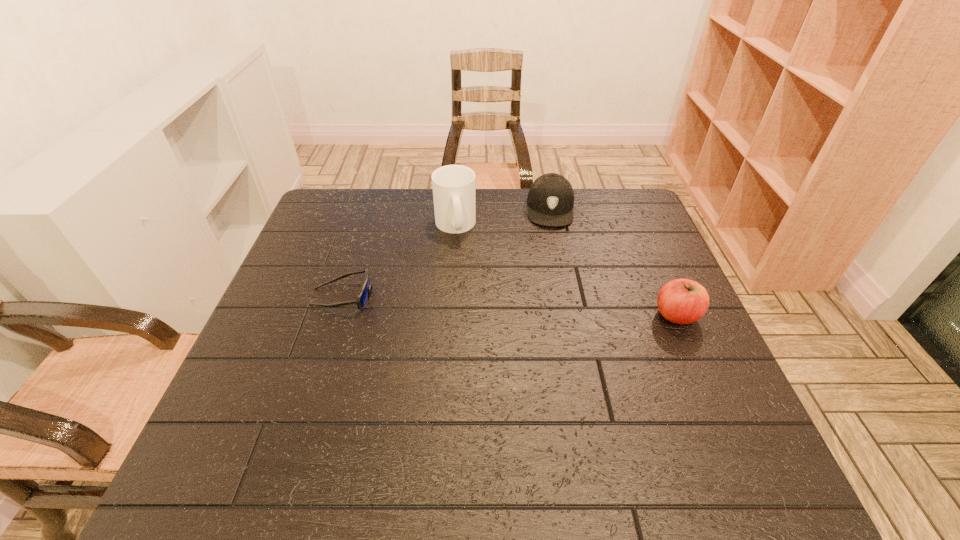
Image resolution: width=960 pixels, height=540 pixels. In order to click on the leftmost object in this screenshot , I will do `click(363, 297)`.

What are the coordinates of `the shortest object` in the screenshot? It's located at (363, 297).

Identify the location of apple. Image resolution: width=960 pixels, height=540 pixels. (x=682, y=301).

This screenshot has height=540, width=960. What are the coordinates of `the tallest object` in the screenshot? It's located at (453, 186).

Where is `the third object from right to left`? Image resolution: width=960 pixels, height=540 pixels. the third object from right to left is located at coordinates (453, 186).

I want to click on the second object from right to left, so click(550, 198).

This screenshot has width=960, height=540. What are the coordinates of `free location located on the front-facing side of the sunglasses` in the screenshot? It's located at (420, 296).

You are a GUI agent. You are given a task and a screenshot of the screen. Output one action in this format:
    pyautogui.click(x=<x>, y=<y>)
    Task: Click on the vacant position located 0.300m on the left of the rightmost object
    This screenshot has height=540, width=960.
    Given the screenshot: What is the action you would take?
    pyautogui.click(x=530, y=315)

Locate an element on the screen. The width and height of the screenshot is (960, 540). vacant area situated on the handle side of the mug is located at coordinates [484, 290].

The image size is (960, 540). I want to click on vacant area situated on the handle side of the mug, so click(471, 263).